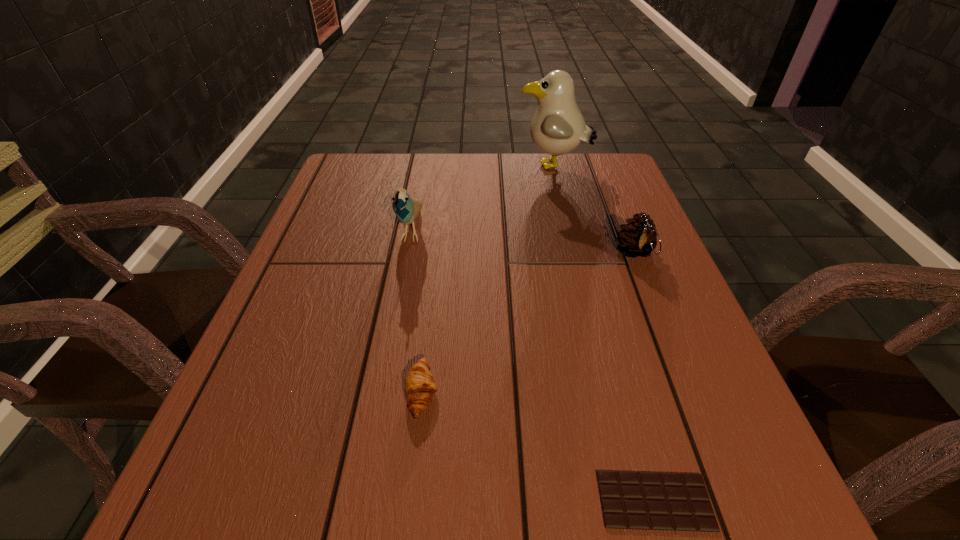
This screenshot has width=960, height=540. Identify the location of the farthest object. (558, 127).

Find the location of a particular element. gull is located at coordinates (558, 127).

Locate an element on the screen. the second tallest object is located at coordinates (407, 208).

The height and width of the screenshot is (540, 960). What are the coordinates of `bird` in the screenshot? It's located at pyautogui.click(x=407, y=208).

The image size is (960, 540). What are the coordinates of `the third shortest object` in the screenshot? It's located at (637, 238).

The width and height of the screenshot is (960, 540). Identify the location of the second object from left to right. (419, 388).

The height and width of the screenshot is (540, 960). Identify the location of the second nearest object. (419, 388).

Identify the location of chocolate bar. The width and height of the screenshot is (960, 540). 630,500.

Locate an element on the screen. the nearest object is located at coordinates (630, 500).

You are a GUI agent. You are given a task and a screenshot of the screen. Output one action in this format:
    pyautogui.click(x=<x>, y=<y>)
    Task: Click on the vacant space located on the beak of the tallest object
    The width and height of the screenshot is (960, 540).
    Given the screenshot: What is the action you would take?
    pyautogui.click(x=429, y=167)